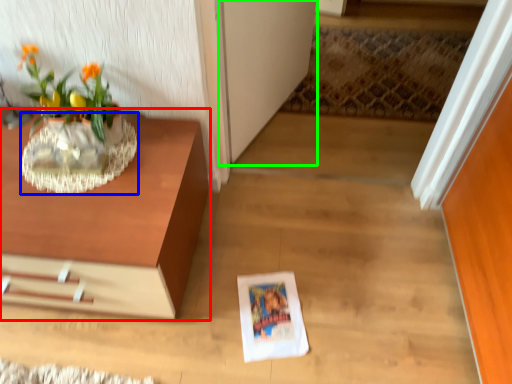
Question: Which is farther away from table (highlighted by a red box)? vase (highlighted by a blue box) or glass door (highlighted by a green box)?

Choices:
 (A) vase
 (B) glass door

Answer: (B)